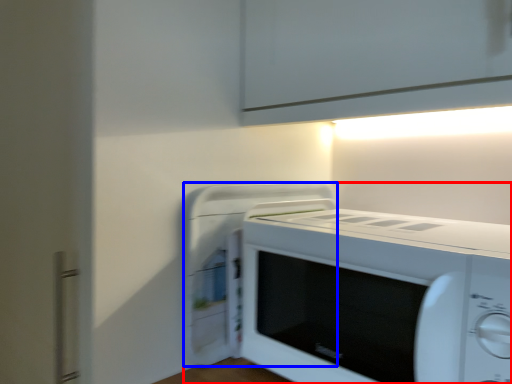
Question: Among these objects, which one is nearest to the camera, home appliance (highlighted by a red box) or appliance (highlighted by a blue box)?

Choices:
 (A) home appliance
 (B) appliance

Answer: (A)